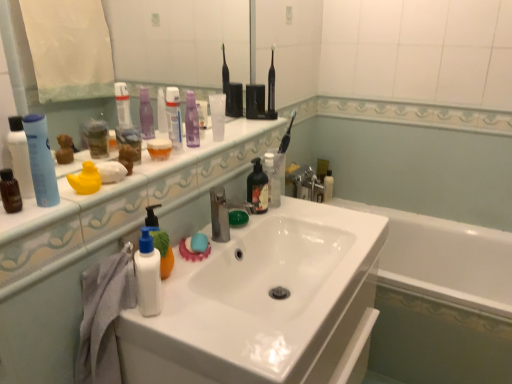
This screenshot has height=384, width=512. In order to click on free point above white glossy counter top at upper center (from a real-world perspective) in this screenshot , I will do `click(185, 149)`.